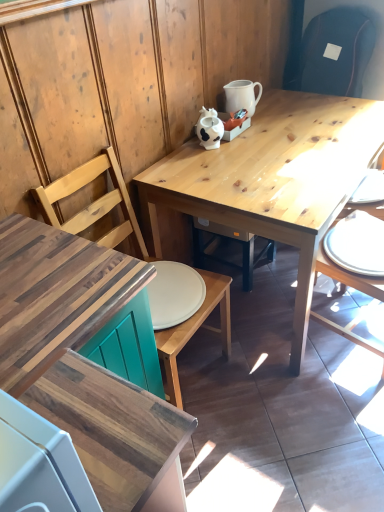
Where is `vacant space situated above white glossy plate at right (from a real-world perspective)`? The image size is (384, 512). vacant space situated above white glossy plate at right (from a real-world perspective) is located at coordinates (357, 233).